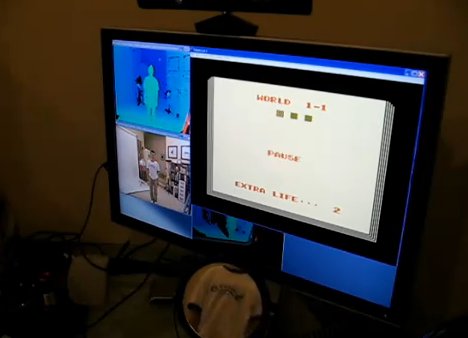
At what (x,y) coordinates should I click in order to perform the action: click on computer monitor. Please return your answer as a coordinate pair (x, y). Image resolution: width=468 pixels, height=338 pixels. Looking at the image, I should click on (391, 226).